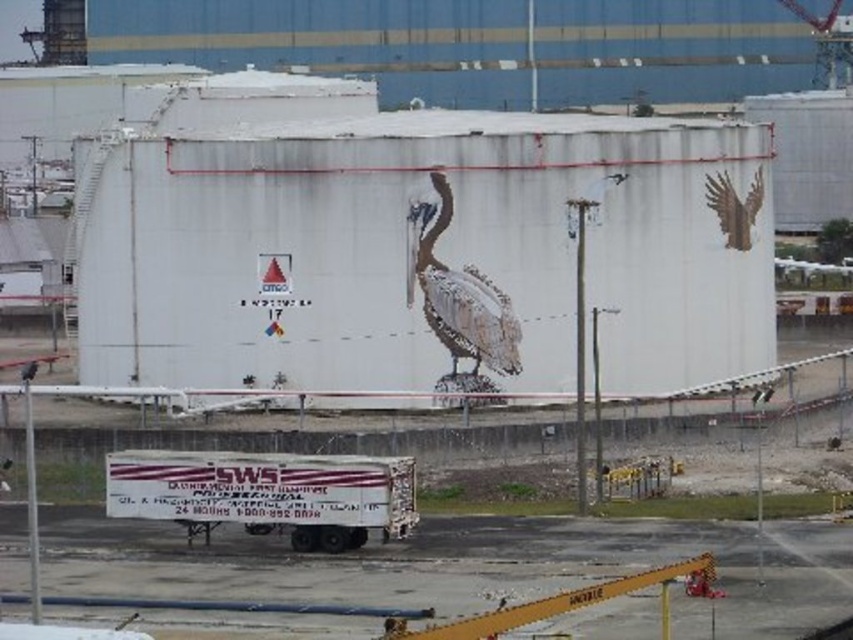
Who is positioned more to the right, white matte trailer truck at center or brown textured pelican at center?

brown textured pelican at center

Looking at this image, who is higher up, white matte trailer truck at center or brown textured pelican at center?

Positioned higher is brown textured pelican at center.

Locate an element on the screen. white matte trailer truck at center is located at coordinates point(268,492).

Who is higher up, white matte trailer truck at center or brown matte wings at upper right?

brown matte wings at upper right is higher up.

Describe the element at coordinates (268, 492) in the screenshot. The image size is (853, 640). I see `white matte trailer truck at center` at that location.

Is point (415, 508) positioned behind point (759, 180)?

No.

You are a GUI agent. You are given a task and a screenshot of the screen. Output one action in this format:
    pyautogui.click(x=<x>, y=<y>)
    Task: Click on the white matte trailer truck at center
    The width and height of the screenshot is (853, 640).
    Given the screenshot: What is the action you would take?
    pyautogui.click(x=268, y=492)

Is point (448, 268) positioned in front of point (737, 230)?

That is True.

Locate an element on the screen. brown textured pelican at center is located at coordinates (459, 294).